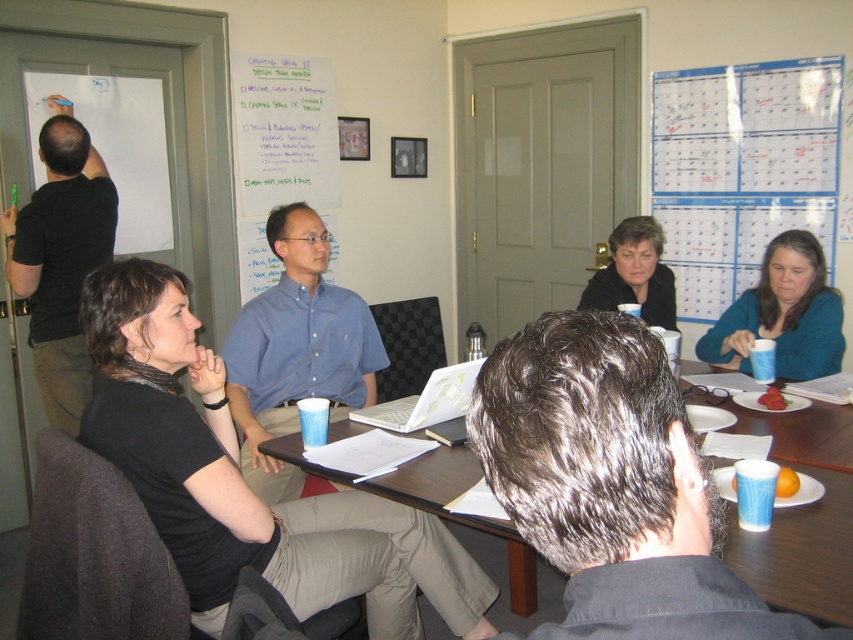
Is point (770, 109) closer to camera compared to point (808, 252)?

That is False.

Is white paper calendar at upper right taller than teal fabric sweater at right?

Correct, white paper calendar at upper right is much taller as teal fabric sweater at right.

Is point (666, 234) behind point (718, 346)?

Yes, it is.

Find the location of a particular element. white paper calendar at upper right is located at coordinates (741, 170).

Does black shirt at left appear on the left side of white plastic laptop at center?

Yes, black shirt at left is to the left of white plastic laptop at center.

Is point (70, 346) closer to viewer compared to point (444, 380)?

That is False.

The height and width of the screenshot is (640, 853). What do you see at coordinates (61, 259) in the screenshot?
I see `black shirt at left` at bounding box center [61, 259].

I want to click on black shirt at left, so click(61, 259).

Which is more to the right, blue shirt at center or teal fabric sweater at right?

Positioned to the right is teal fabric sweater at right.

Which is below, blue shirt at center or teal fabric sweater at right?

blue shirt at center is lower down.

Does point (265, 486) come behind point (782, 316)?

No, (265, 486) is closer to viewer.

Locate an element on the screen. The width and height of the screenshot is (853, 640). blue shirt at center is located at coordinates (296, 349).